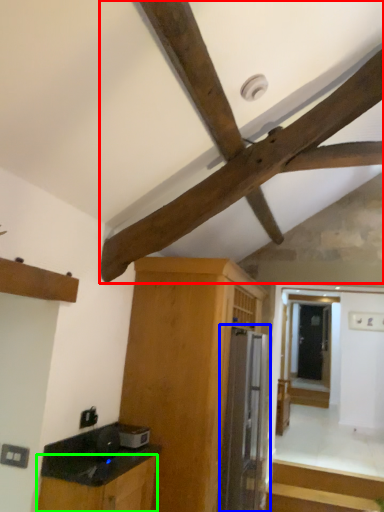
Question: Based on their relative distances, which object is farther from exhaust hood (highlighted by a red box)? Choose from appliance (highlighted by a blue box) and cabinetry (highlighted by a green box).

Choices:
 (A) appliance
 (B) cabinetry

Answer: (A)